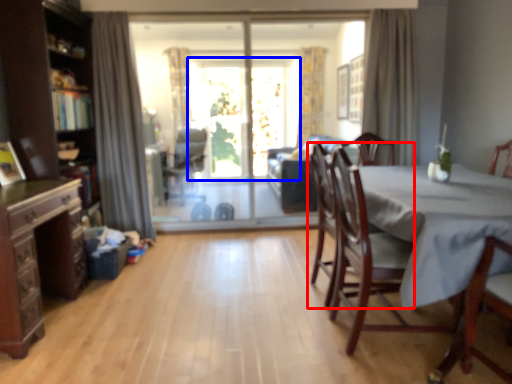
Question: Which object appears closest to the camera in this image, chair (highlighted by a red box) or window screen (highlighted by a blue box)?

Choices:
 (A) chair
 (B) window screen

Answer: (A)